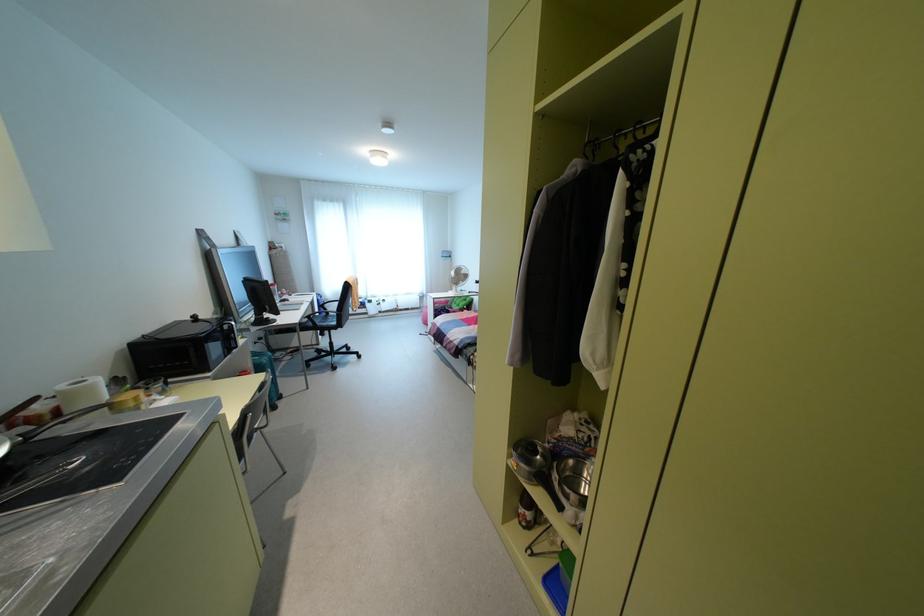
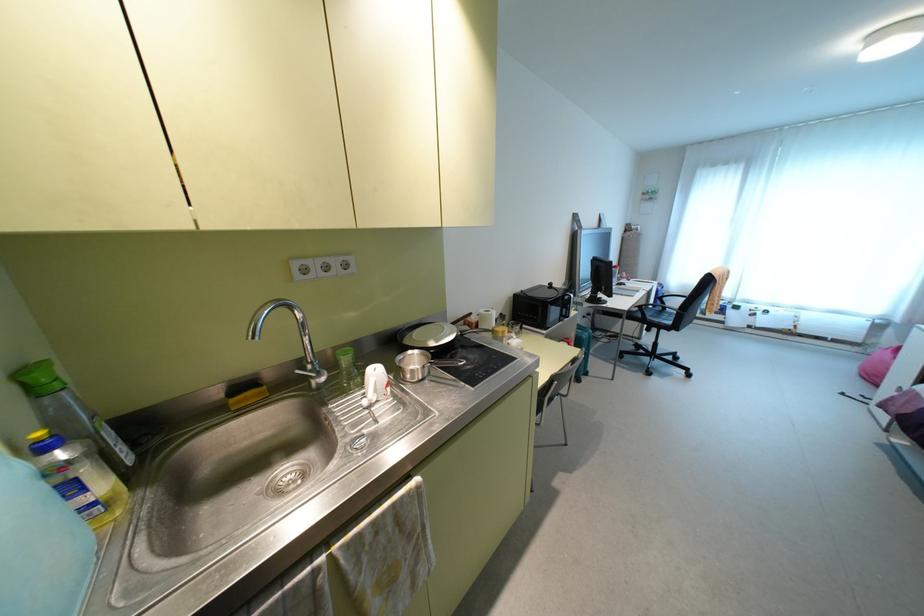
Where in the second image is the point corresponding to point (249, 438) from the first image?

(551, 399)